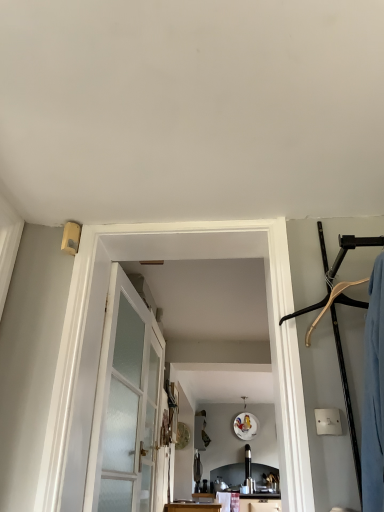
Question: Is clear glass door at center shorter than white frosted glass barn door at center?

Choices:
 (A) yes
 (B) no

Answer: (B)

Question: Is clear glass door at center not within white frosted glass barn door at center?

Choices:
 (A) yes
 (B) no

Answer: (A)

Question: Considering the relative sizes of clear glass door at center and white frosted glass barn door at center in the image provided, is clear glass door at center bigger than white frosted glass barn door at center?

Choices:
 (A) yes
 (B) no

Answer: (B)

Question: Considering the relative sizes of clear glass door at center and white frosted glass barn door at center in the image provided, is clear glass door at center wider than white frosted glass barn door at center?

Choices:
 (A) no
 (B) yes

Answer: (A)

Question: Is clear glass door at center closer to camera compared to white frosted glass barn door at center?

Choices:
 (A) no
 (B) yes

Answer: (A)

Question: Does clear glass door at center have a smaller size compared to white frosted glass barn door at center?

Choices:
 (A) no
 (B) yes

Answer: (B)

Question: Is satin glass door at center facing towards white frosted glass barn door at center?

Choices:
 (A) yes
 (B) no

Answer: (B)

Question: Can you confirm if satin glass door at center is positioned to the right of white frosted glass barn door at center?

Choices:
 (A) yes
 (B) no

Answer: (B)

Question: From the image's perspective, does satin glass door at center appear higher than white frosted glass barn door at center?

Choices:
 (A) yes
 (B) no

Answer: (B)

Question: Is the depth of satin glass door at center less than that of white frosted glass barn door at center?

Choices:
 (A) yes
 (B) no

Answer: (B)

Question: Is white frosted glass barn door at center completely or partially inside satin glass door at center?

Choices:
 (A) no
 (B) yes

Answer: (A)

Question: Does satin glass door at center have a greater height compared to white frosted glass barn door at center?

Choices:
 (A) no
 (B) yes

Answer: (A)

Question: From a real-world perspective, does clear glass door at center sit lower than satin glass door at center?

Choices:
 (A) yes
 (B) no

Answer: (B)